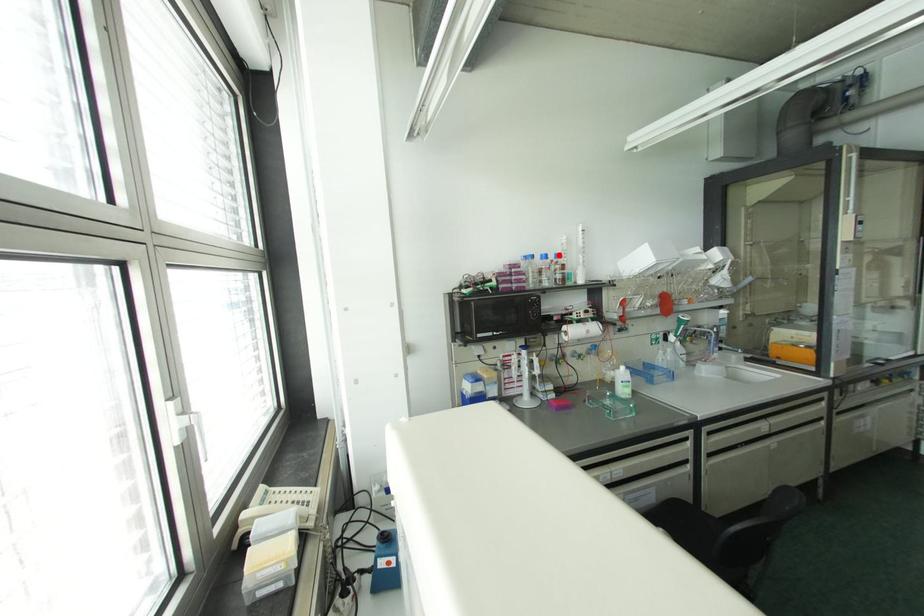
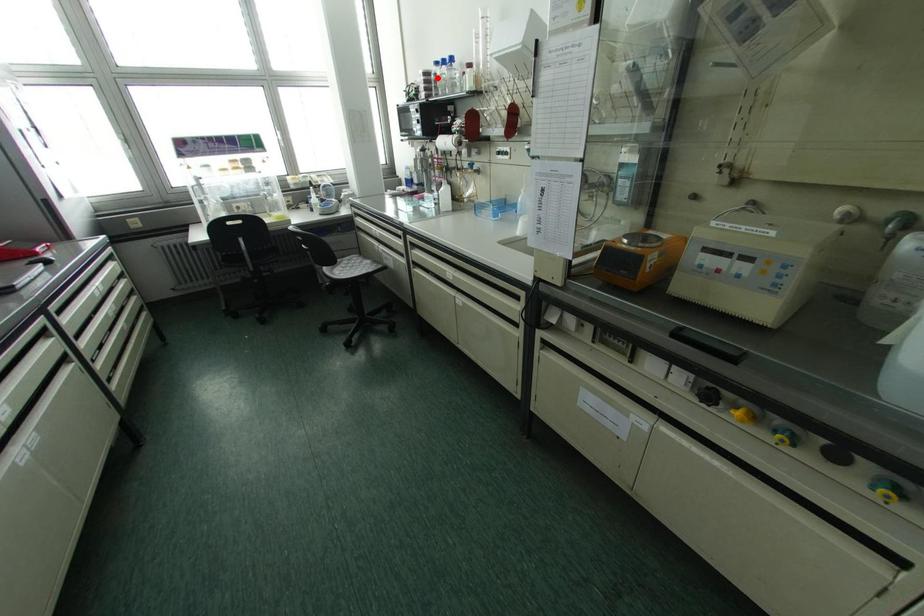
I am providing you with two images of the same scene from different viewpoints. A red point is marked on the first image and another point is marked on the second image. Is the marked point in image1 the same physical position as the marked point in image2?

No